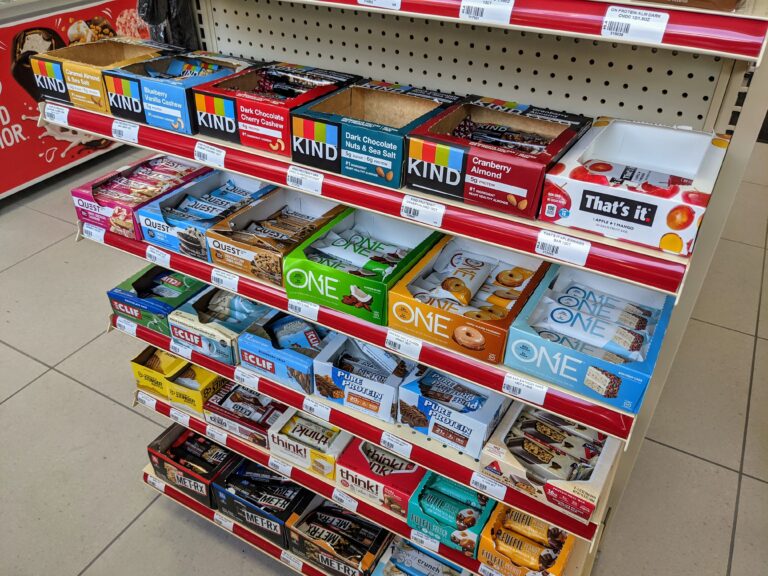
The height and width of the screenshot is (576, 768). In order to click on beige floor in this screenshot , I will do `click(64, 468)`, `click(727, 396)`.